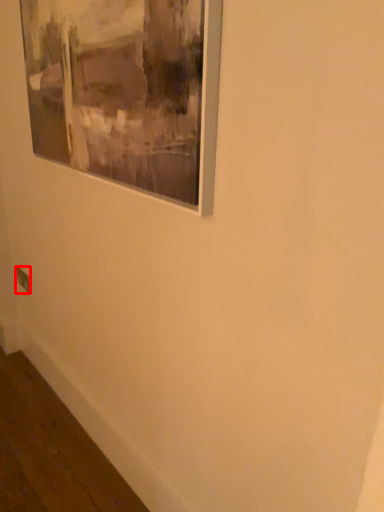
Question: From the image, what is the correct spatial relationship of electric outlet (annotated by the red box) in relation to picture frame?

Choices:
 (A) right
 (B) left

Answer: (B)